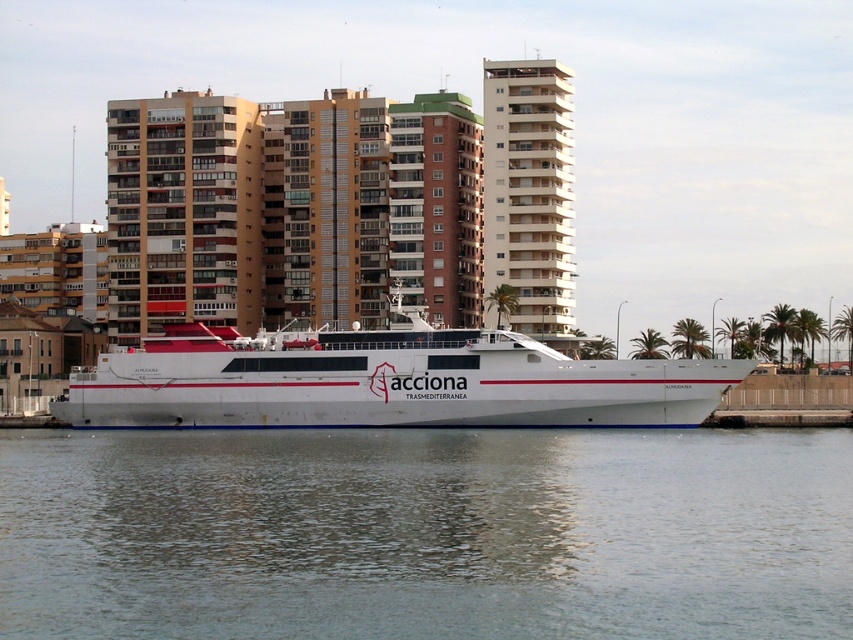
Who is more forward, (450, 474) or (427, 349)?

Positioned in front is point (450, 474).

Based on the photo, is clear water at lower center above white matte ship at center?

Incorrect, clear water at lower center is not positioned above white matte ship at center.

The image size is (853, 640). Describe the element at coordinates (425, 532) in the screenshot. I see `clear water at lower center` at that location.

You are a GUI agent. You are given a task and a screenshot of the screen. Output one action in this format:
    pyautogui.click(x=<x>, y=<y>)
    Task: Click on the clear water at lower center
    
    Given the screenshot: What is the action you would take?
    pyautogui.click(x=425, y=532)